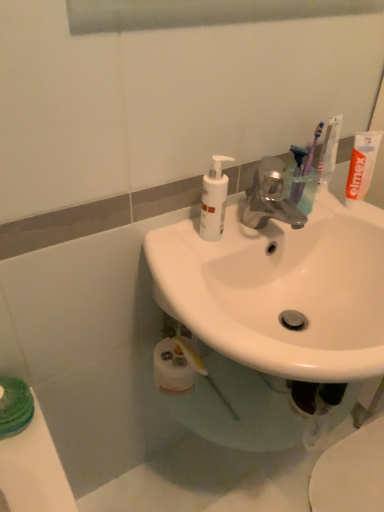
The image size is (384, 512). I want to click on vacant space underneath white glossy toilet at lower right (from a real-world perspective), so click(x=349, y=475).